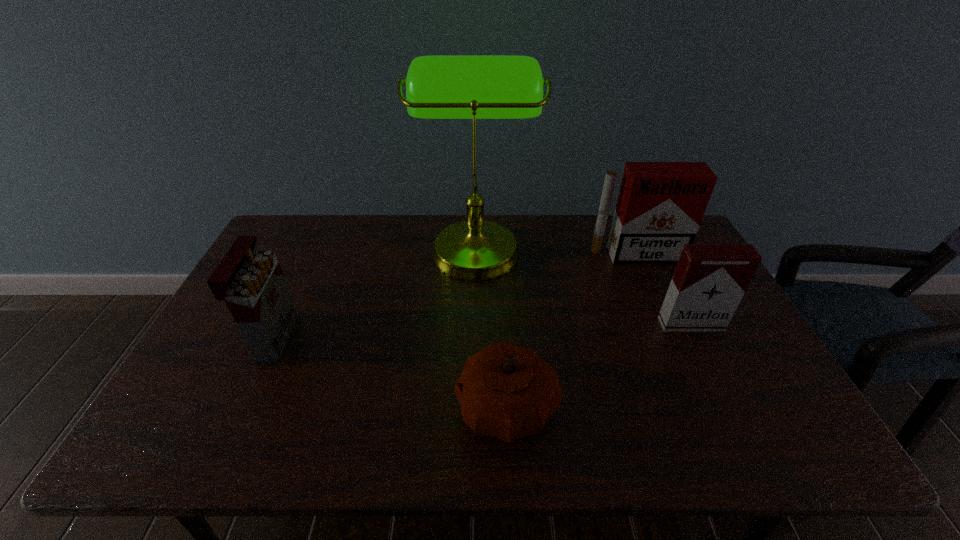
Identify the location of vacant space situated on the front-facing side of the nearest object. The image size is (960, 540). (413, 407).

You are a GUI agent. You are given a task and a screenshot of the screen. Output one action in this format:
    pyautogui.click(x=<x>, y=<y>)
    Task: Click on the lamp that is at the far edge
    
    Given the screenshot: What is the action you would take?
    pyautogui.click(x=474, y=87)

The width and height of the screenshot is (960, 540). In order to click on cigarette case at the far edge in this screenshot , I will do `click(660, 206)`.

This screenshot has height=540, width=960. Find the location of `object present at the near edge`. object present at the near edge is located at coordinates (506, 391).

I want to click on object situated at the left edge, so click(251, 282).

Identify the location of object situated at the far right corner. Image resolution: width=960 pixels, height=540 pixels. (660, 206).

Where is `vacant position at the far edge of the desktop`? Image resolution: width=960 pixels, height=540 pixels. vacant position at the far edge of the desktop is located at coordinates (543, 237).

The height and width of the screenshot is (540, 960). In order to click on free spot at the near edge of the desktop in this screenshot , I will do `click(574, 432)`.

The image size is (960, 540). In the image, there is a desktop. In order to click on vacant space at the left edge in this screenshot , I will do point(202,362).

Image resolution: width=960 pixels, height=540 pixels. In the image, there is a desktop. What are the coordinates of `vacant space at the near left corner` in the screenshot? It's located at (218, 440).